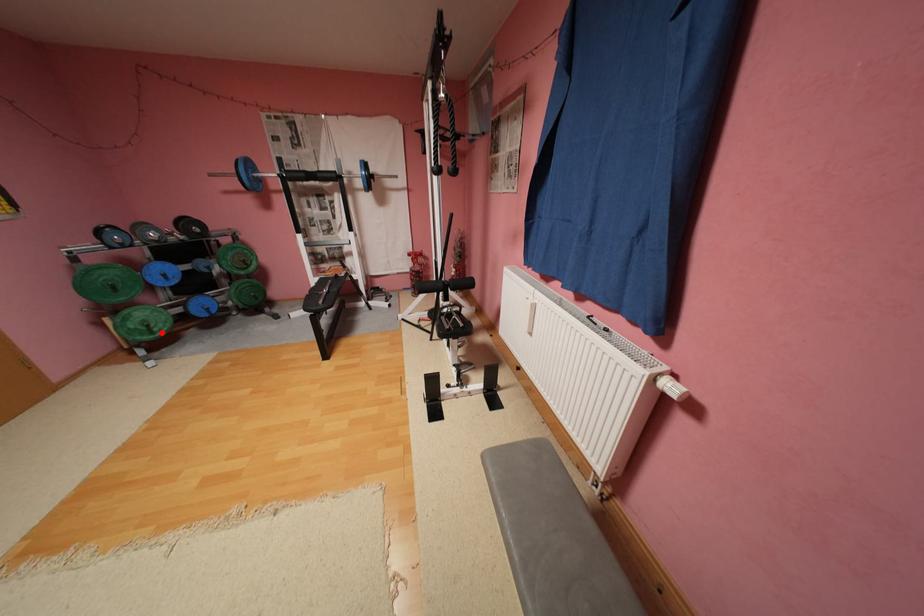
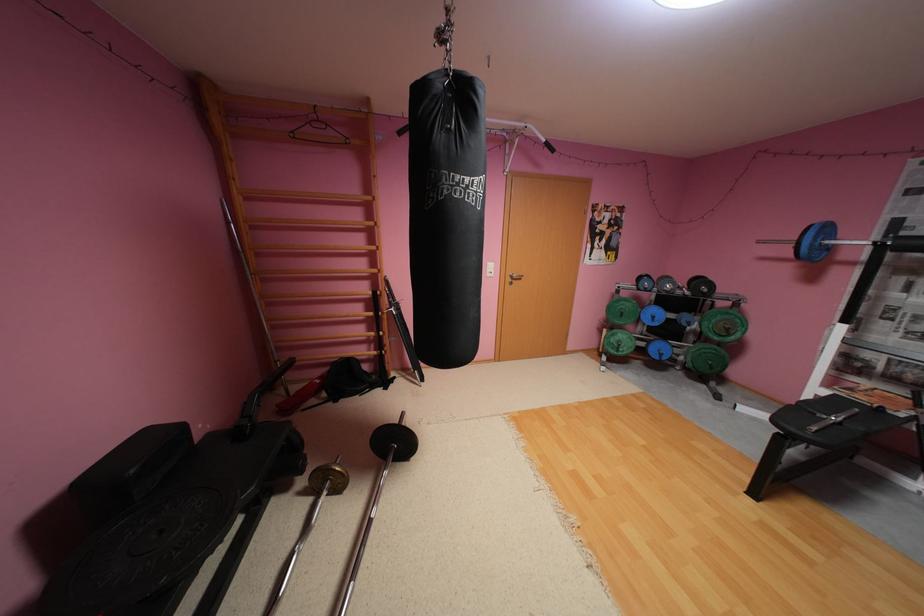
Question: I am providing you with two images of the same scene from different viewpoints. Image1 has a red point marked. In image2, the corresponding 3D location appears at what relative position? Reply with the corresponding letter.

Choices:
 (A) Closer
 (B) Farther

Answer: (A)